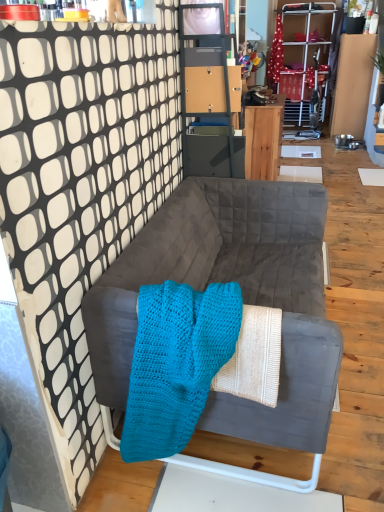
Question: Can you confirm if suede gray couch at center is bigger than matte gray cabinet at upper center?

Choices:
 (A) no
 (B) yes

Answer: (B)

Question: Can you confirm if suede gray couch at center is thinner than matte gray cabinet at upper center?

Choices:
 (A) no
 (B) yes

Answer: (A)

Question: Is suede gray couch at center closer to the viewer compared to matte gray cabinet at upper center?

Choices:
 (A) no
 (B) yes

Answer: (B)

Question: Would you say suede gray couch at center contains matte gray cabinet at upper center?

Choices:
 (A) yes
 (B) no

Answer: (B)

Question: From a real-world perspective, is suede gray couch at center physically below matte gray cabinet at upper center?

Choices:
 (A) no
 (B) yes

Answer: (B)

Question: From the image's perspective, is suede gray couch at center positioned above or below matte gray cabinet at upper center?

Choices:
 (A) above
 (B) below

Answer: (B)

Question: Considering the positions of suede gray couch at center and matte gray cabinet at upper center in the image, is suede gray couch at center bigger or smaller than matte gray cabinet at upper center?

Choices:
 (A) big
 (B) small

Answer: (A)

Question: Would you say suede gray couch at center is to the left or to the right of matte gray cabinet at upper center in the picture?

Choices:
 (A) right
 (B) left

Answer: (A)

Question: Is suede gray couch at center spatially inside matte gray cabinet at upper center, or outside of it?

Choices:
 (A) inside
 (B) outside

Answer: (B)

Question: From the image's perspective, is turquoise knitted blanket at center located above or below suede gray couch at center?

Choices:
 (A) below
 (B) above

Answer: (A)

Question: Considering their positions, is turquoise knitted blanket at center located in front of or behind suede gray couch at center?

Choices:
 (A) behind
 (B) front

Answer: (B)

Question: Considering the positions of point (148, 395) and point (178, 210), is point (148, 395) closer or farther from the camera than point (178, 210)?

Choices:
 (A) closer
 (B) farther

Answer: (A)

Question: Is turquoise knitted blanket at center inside or outside of suede gray couch at center?

Choices:
 (A) inside
 (B) outside

Answer: (A)

Question: Considering the positions of point (200, 84) and point (269, 128), is point (200, 84) closer or farther from the camera than point (269, 128)?

Choices:
 (A) farther
 (B) closer

Answer: (B)

Question: From a real-world perspective, is matte gray cabinet at upper center positioned above or below wooden desk at center?

Choices:
 (A) below
 (B) above

Answer: (B)